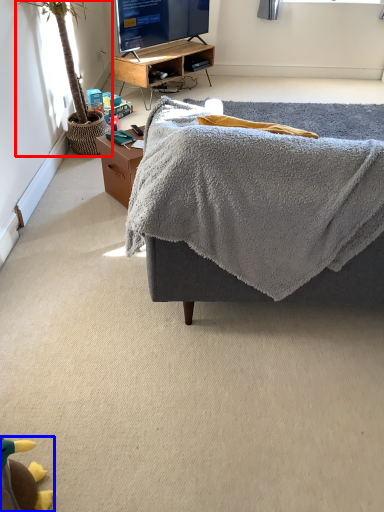
Question: Which point is closer to the camera, houseplant (highlighted by a red box) or toy (highlighted by a blue box)?

Choices:
 (A) houseplant
 (B) toy

Answer: (B)